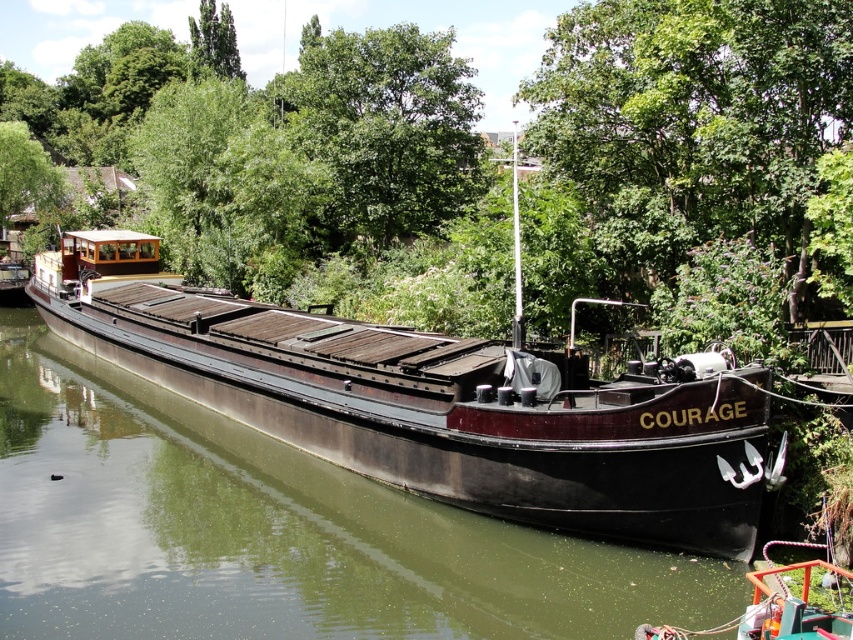
Between green leafy tree at center and dark brown wooden barge at center, which one has less height?

Standing shorter between the two is dark brown wooden barge at center.

Between green leafy tree at center and dark brown wooden barge at center, which one appears on the left side from the viewer's perspective?

Positioned to the left is dark brown wooden barge at center.

Between point (566, 177) and point (363, 436), which one is positioned in front?

Point (363, 436)

The width and height of the screenshot is (853, 640). I want to click on green leafy tree at center, so coord(293,168).

Is green leafy tree at center taller than green leafy tree at upper center?

Indeed, green leafy tree at center has a greater height compared to green leafy tree at upper center.

Does point (418, 52) come closer to viewer compared to point (456, 116)?

Yes, point (418, 52) is in front of point (456, 116).

Find the location of a particular element. The image size is (853, 640). green leafy tree at center is located at coordinates coord(293,168).

You are a GUI agent. You are given a task and a screenshot of the screen. Output one action in this format:
    pyautogui.click(x=<x>, y=<y>)
    Task: Click on the dark brown wooden barge at center
    
    Given the screenshot: What is the action you would take?
    pyautogui.click(x=433, y=403)

Between dark brown wooden barge at center and green leafy tree at upper center, which one appears on the right side from the viewer's perspective?

From the viewer's perspective, green leafy tree at upper center appears more on the right side.

In order to click on dark brown wooden barge at center in this screenshot , I will do `click(433, 403)`.